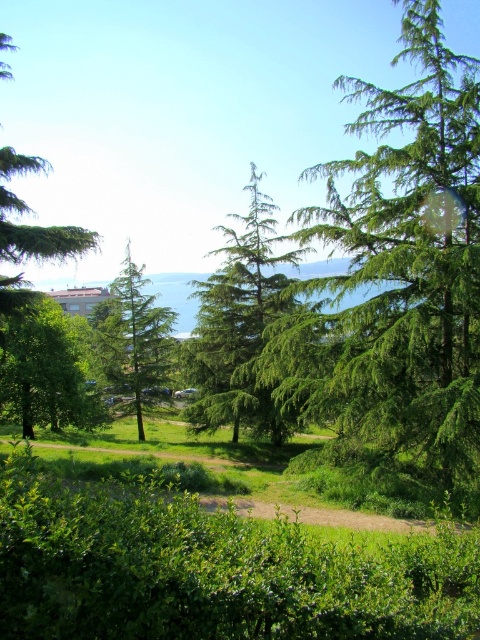
Does green leafy tree at left lie behind green matte tree at upper left?

Yes, green leafy tree at left is further from the viewer.

Between green leafy tree at left and green matte tree at upper left, which one is positioned lower?

green leafy tree at left is below.

Does point (100, 419) come closer to viewer compared to point (19, 163)?

That is False.

Identify the location of green leafy tree at left. The height and width of the screenshot is (640, 480). (46, 371).

Can you confirm if green needle-like at center is bigger than green needle-like tree at center?

No.

Image resolution: width=480 pixels, height=640 pixels. I want to click on green needle-like at center, so click(x=399, y=285).

Between green needle-like at center and green matte tree at center, which one appears on the left side from the viewer's perspective?

Positioned to the left is green matte tree at center.

Who is taller, green needle-like at center or green matte tree at center?

With more height is green needle-like at center.

Identify the location of green needle-like at center. Image resolution: width=480 pixels, height=640 pixels. (399, 285).

At what (x,y) coordinates should I click in order to perform the action: click on green needle-like at center. Please return your answer as a coordinate pair (x, y). This screenshot has height=640, width=480. Looking at the image, I should click on (399, 285).